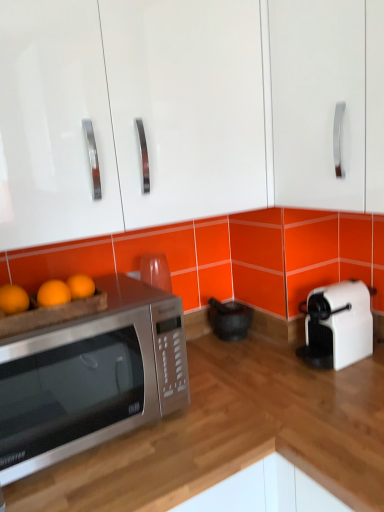
Question: Does white plastic toaster at right appear on the right side of glossy white cabinet at upper center, placed as the 1th cabinetry when sorted from left to right?

Choices:
 (A) no
 (B) yes

Answer: (B)

Question: From the image's perspective, is white plastic toaster at right below glossy white cabinet at upper center, placed as the 1th cabinetry when sorted from left to right?

Choices:
 (A) no
 (B) yes

Answer: (B)

Question: From the image's perspective, is white plastic toaster at right over glossy white cabinet at upper center, placed as the 1th cabinetry when sorted from left to right?

Choices:
 (A) no
 (B) yes

Answer: (A)

Question: Can you confirm if white plastic toaster at right is positioned to the left of glossy white cabinet at upper center, positioned as the second cabinetry in right-to-left order?

Choices:
 (A) yes
 (B) no

Answer: (B)

Question: From a real-world perspective, does white plastic toaster at right stand above glossy white cabinet at upper center, placed as the 1th cabinetry when sorted from left to right?

Choices:
 (A) no
 (B) yes

Answer: (A)

Question: Relative to black matte mortar and pestle at center, is glossy white cabinet at upper center, positioned as the second cabinetry in right-to-left order, in front or behind?

Choices:
 (A) behind
 (B) front

Answer: (B)

Question: From the image's perspective, is glossy white cabinet at upper center, placed as the 1th cabinetry when sorted from left to right, located above or below black matte mortar and pestle at center?

Choices:
 (A) above
 (B) below

Answer: (A)

Question: Considering the positions of glossy white cabinet at upper center, placed as the 1th cabinetry when sorted from left to right, and black matte mortar and pestle at center in the image, is glossy white cabinet at upper center, placed as the 1th cabinetry when sorted from left to right, wider or thinner than black matte mortar and pestle at center?

Choices:
 (A) wide
 (B) thin

Answer: (A)

Question: From a real-world perspective, is glossy white cabinet at upper center, placed as the 1th cabinetry when sorted from left to right, positioned above or below black matte mortar and pestle at center?

Choices:
 (A) above
 (B) below

Answer: (A)

Question: In terms of height, does silver metallic microwave at lower left look taller or shorter compared to satin silver microwave at left?

Choices:
 (A) tall
 (B) short

Answer: (A)

Question: In the image, is silver metallic microwave at lower left on the left side or the right side of satin silver microwave at left?

Choices:
 (A) right
 (B) left

Answer: (A)

Question: Considering their positions, is silver metallic microwave at lower left located in front of or behind satin silver microwave at left?

Choices:
 (A) front
 (B) behind

Answer: (A)

Question: From the image's perspective, relative to satin silver microwave at left, is silver metallic microwave at lower left above or below?

Choices:
 (A) below
 (B) above

Answer: (A)

Question: From a real-world perspective, relative to satin silver microwave at left, is white glossy cabinet handle at upper right, acting as the second cabinetry starting from the left, vertically above or below?

Choices:
 (A) below
 (B) above

Answer: (B)

Question: From their relative heights in the image, would you say white glossy cabinet handle at upper right, which is the first cabinetry from right to left, is taller or shorter than satin silver microwave at left?

Choices:
 (A) short
 (B) tall

Answer: (B)